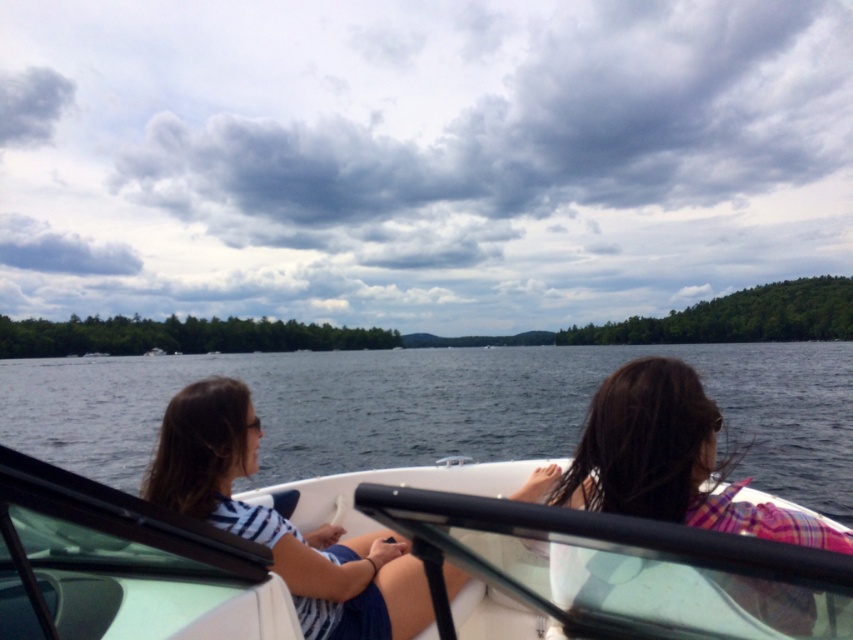
Looking at this image, you are standing on the dock and want to board the boat. The boat is at point (579, 560). Which direction should you walk to reach the boat?

The point (579, 560) corresponds to the white glossy boat at center, so you should walk towards the center of the image to reach the boat.

You are a photographer on the shore of the lake. You want to take a photo of the plaid fabric hair at center and the striped fabric shirt at left. Which one is positioned to the right side of the other?

The plaid fabric hair at center is to the right of the striped fabric shirt at left.